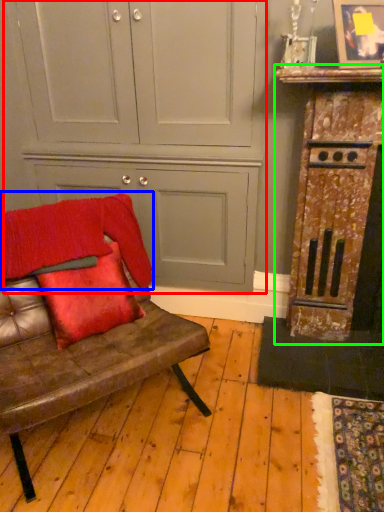
Question: Which object is positioned closest to dresser (highlighted by a red box)? Select from blanket (highlighted by a blue box) and dresser (highlighted by a green box).

Choices:
 (A) blanket
 (B) dresser

Answer: (A)